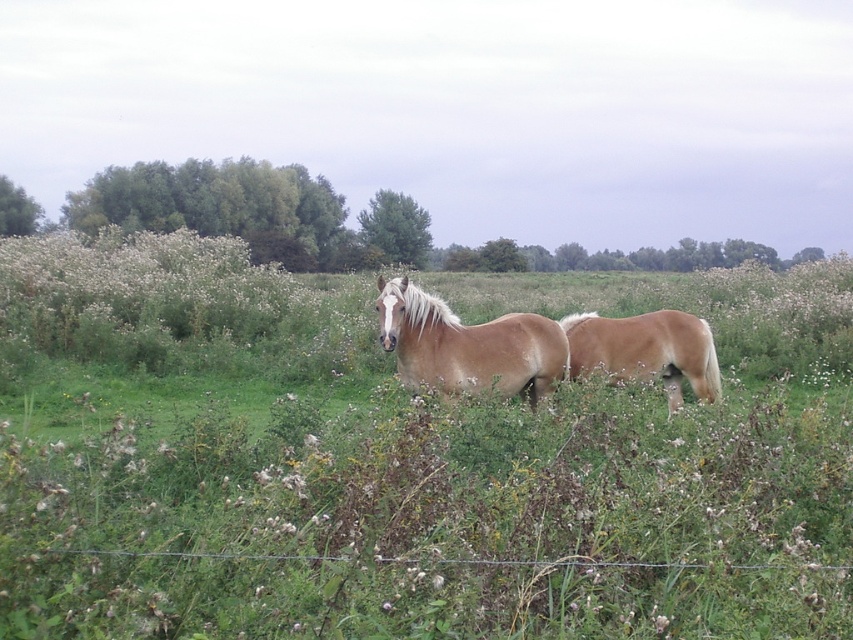
Question: Among these points, which one is nearest to the camera?

Choices:
 (A) (614, 380)
 (B) (492, 353)

Answer: (B)

Question: Does brown matte horse at center appear over light brown horse at center?

Choices:
 (A) yes
 (B) no

Answer: (A)

Question: Can you confirm if brown matte horse at center is positioned below light brown horse at center?

Choices:
 (A) no
 (B) yes

Answer: (A)

Question: Does brown matte horse at center appear under light brown horse at center?

Choices:
 (A) yes
 (B) no

Answer: (B)

Question: Which point is farther to the camera?

Choices:
 (A) brown matte horse at center
 (B) light brown horse at center

Answer: (B)